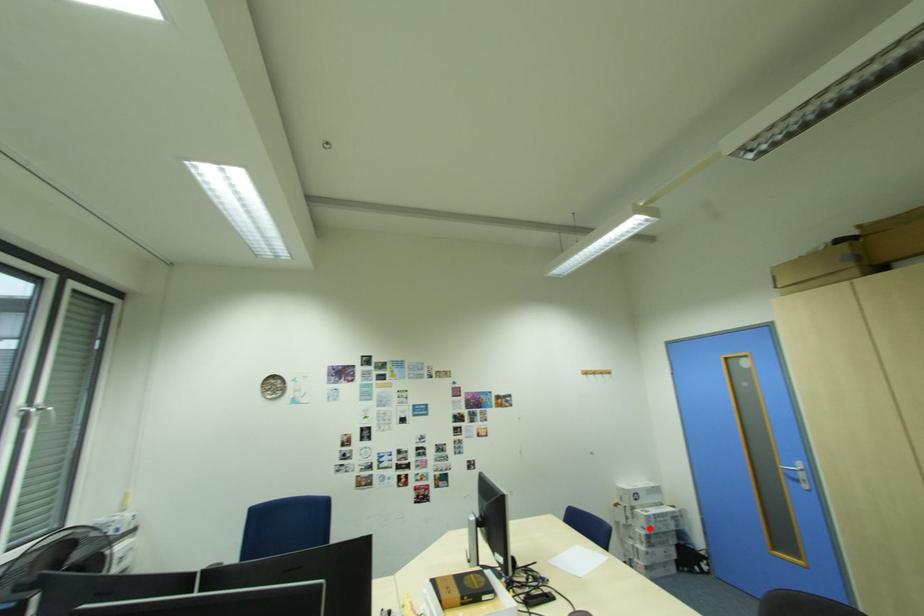
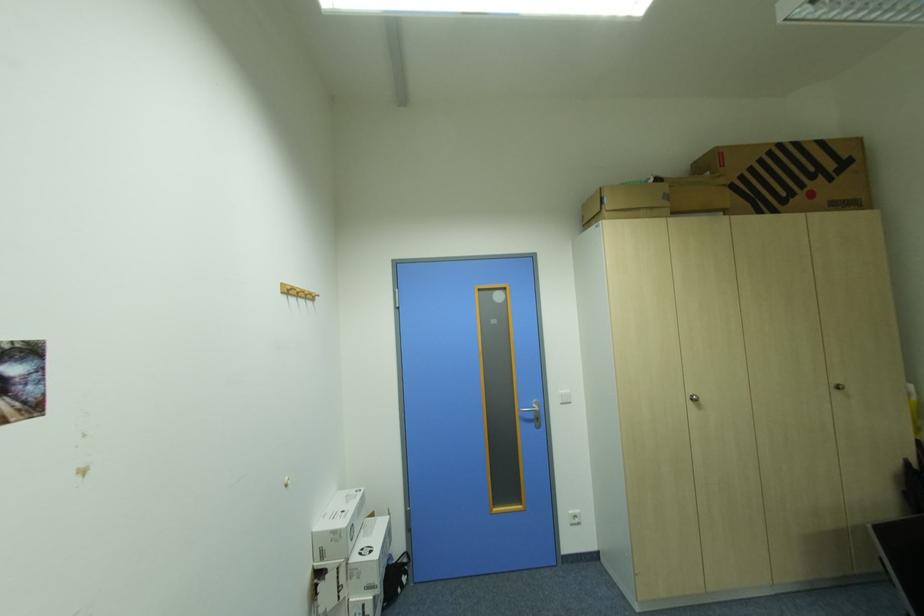
Locate, in the second image, the point that corresponds to the highlighted location in the first image.

(377, 590)